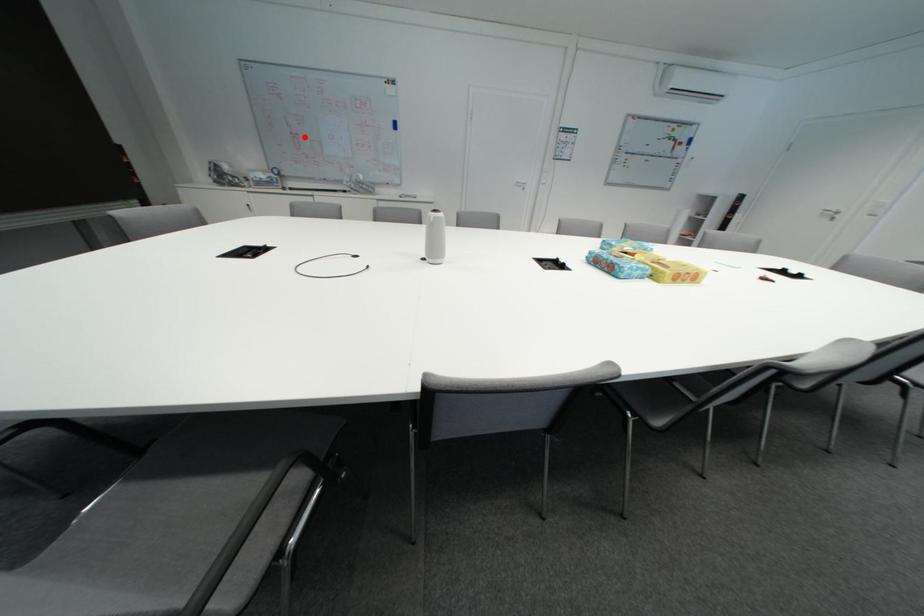
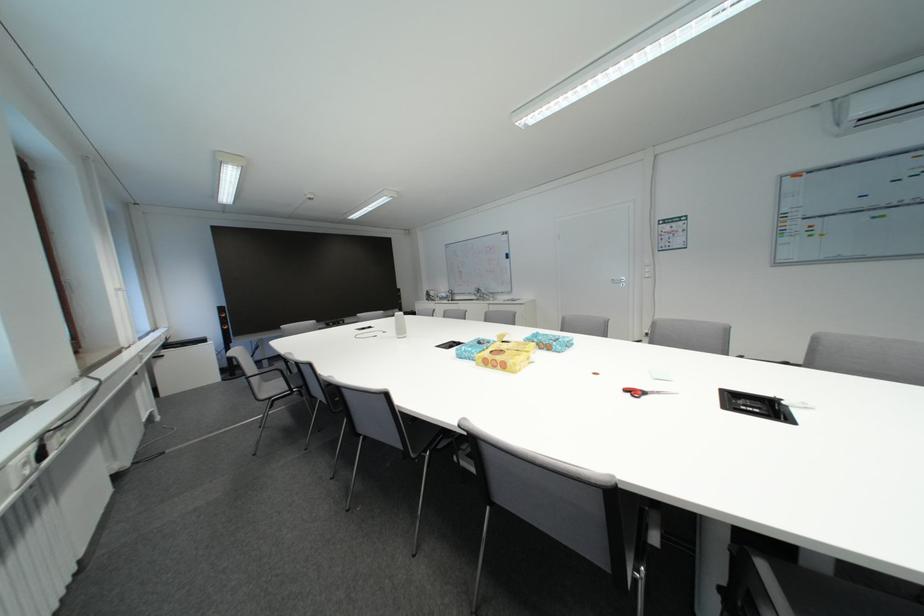
Question: I am providing you with two images of the same scene from different viewpoints. Image1 has a red point marked. In image2, the corresponding 3D location appears at what relative position? Reply with the corresponding letter.

Choices:
 (A) Closer
 (B) Farther

Answer: (A)